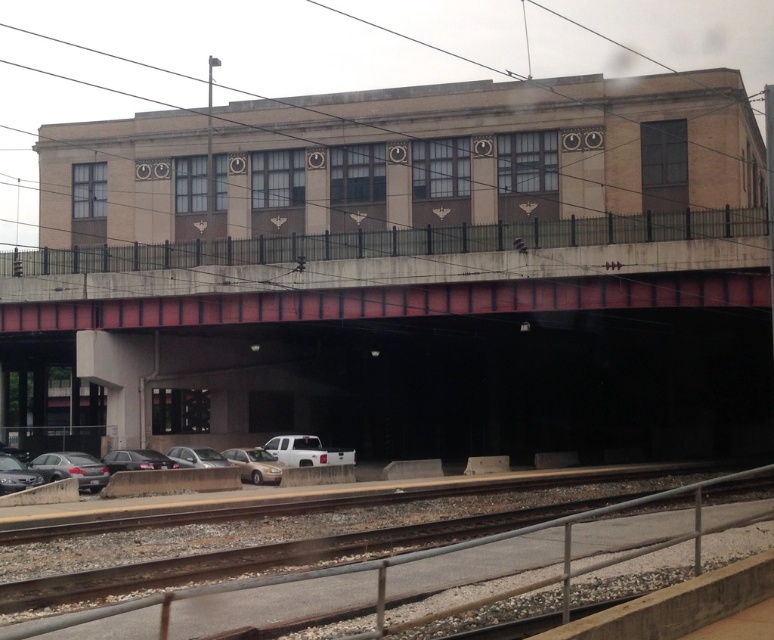
Between smooth steel tracks at lower center and silver metallic truck at lower center, which one appears on the right side from the viewer's perspective?

Positioned to the right is smooth steel tracks at lower center.

Which is below, smooth steel tracks at lower center or silver metallic truck at lower center?

silver metallic truck at lower center

Measure the distance between smooth steel tracks at lower center and camera.

smooth steel tracks at lower center and camera are 5.10 meters apart.

Where is `smooth steel tracks at lower center`? smooth steel tracks at lower center is located at coordinates (350, 547).

Who is taller, white matte truck at lower center or shiny silver sedan at lower left?

shiny silver sedan at lower left is taller.

Is point (314, 456) positioned in front of point (7, 486)?

That is False.

Locate an element on the screen. The height and width of the screenshot is (640, 774). white matte truck at lower center is located at coordinates (307, 451).

Between point (522, 285) and point (7, 484), which one is positioned behind?

Positioned behind is point (522, 285).

Does concrete bridge at center have a lesser width compared to shiny silver sedan at lower left?

No, concrete bridge at center is not thinner than shiny silver sedan at lower left.

Is point (348, 288) farther from camera compared to point (5, 458)?

Yes, point (348, 288) is farther from viewer.

Locate an element on the screen. concrete bridge at center is located at coordinates (394, 273).